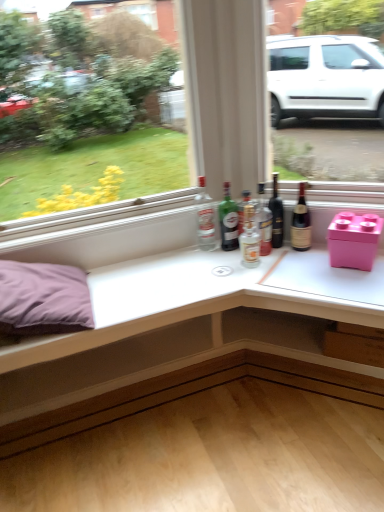
Locate an element on the screen. Image resolution: width=384 pixels, height=512 pixels. vacant area that lies in front of clear glass bottle at center, which is the first bottle in left-to-right order is located at coordinates (207, 261).